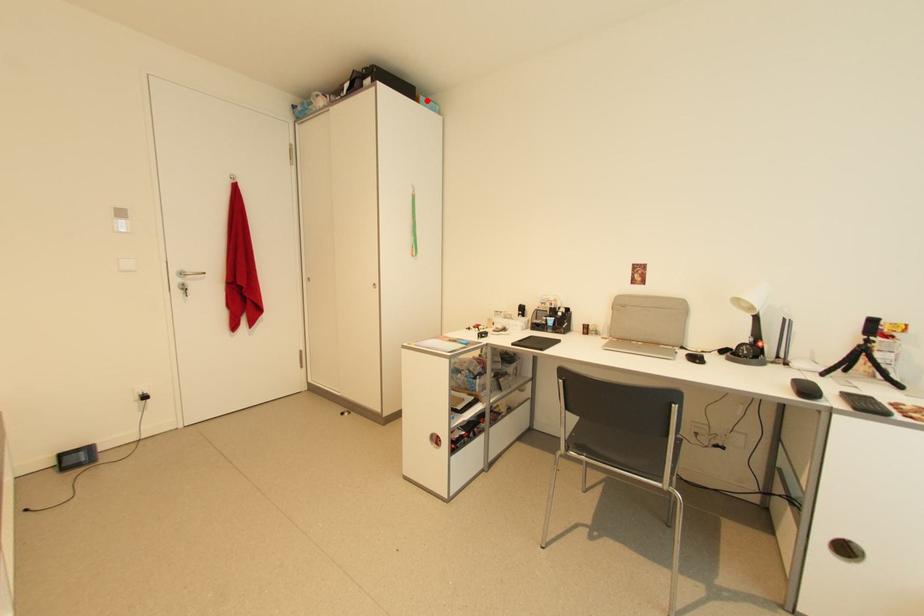
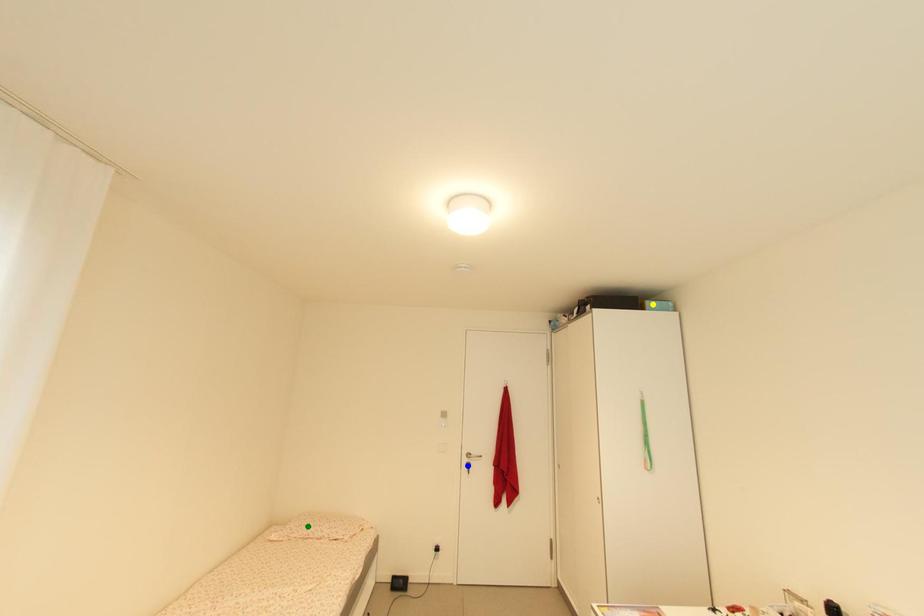
Question: I am providing you with two images of the same scene from different viewpoints. A red point is marked on the first image. You are given multiple points on the second image. Which point in image 2 is actually the same real-world point as the red point in image 1?

Choices:
 (A) yellow point
 (B) green point
 (C) blue point

Answer: (A)